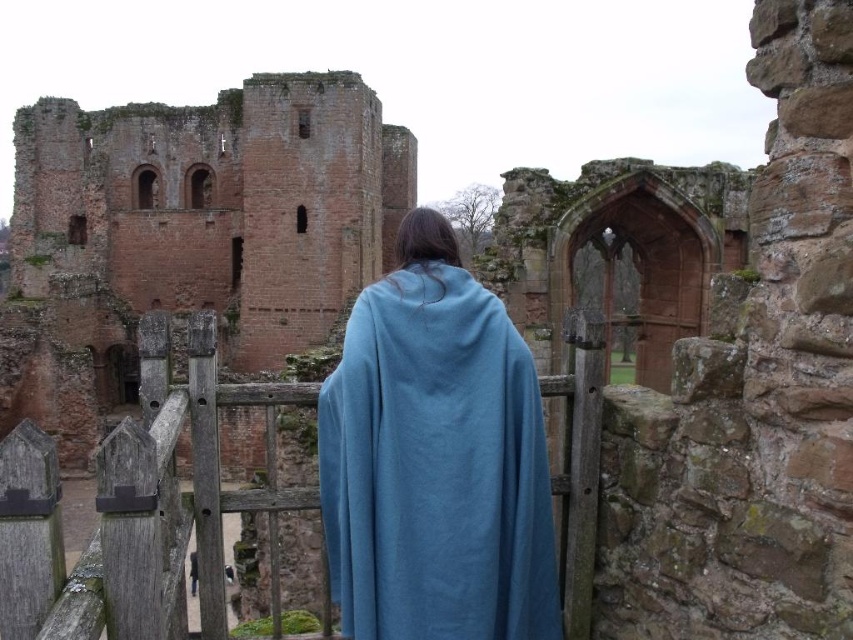
In the scene shown: Who is positioned more to the right, red brick wall at left or wooden at center?

wooden at center

Does red brick wall at left have a lesser width compared to wooden at center?

Incorrect, red brick wall at left's width is not less than wooden at center's.

I want to click on red brick wall at left, so click(x=192, y=230).

Between point (474, 442) and point (111, 632), which one is positioned in front?

Point (111, 632) is in front.

Can you confirm if blue woolen cloak at center is wider than wooden at center?

No.

Who is more distant from viewer, (506, 516) or (137, 566)?

The point (506, 516) is more distant.

You are a GUI agent. You are given a task and a screenshot of the screen. Output one action in this format:
    pyautogui.click(x=<x>, y=<y>)
    Task: Click on the blue woolen cloak at center
    The height and width of the screenshot is (640, 853).
    Given the screenshot: What is the action you would take?
    click(434, 458)

Does red brick wall at left appear under blue woolen cloak at center?

No.

Is red brick wall at left further to the viewer compared to blue woolen cloak at center?

Yes, red brick wall at left is behind blue woolen cloak at center.

Is point (120, 317) positioned in front of point (397, 372)?

No, (120, 317) is further to viewer.

What are the coordinates of `red brick wall at left` in the screenshot? It's located at (192, 230).